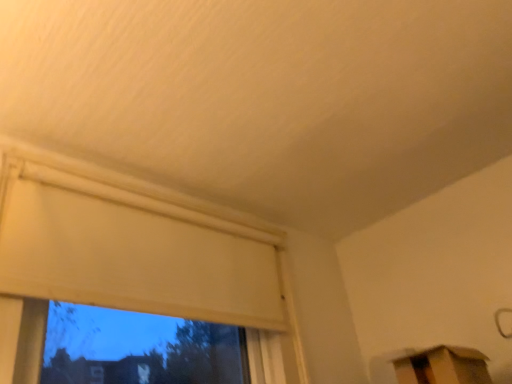
The image size is (512, 384). What do you see at coordinates (443, 366) in the screenshot? I see `cardboard box at lower right` at bounding box center [443, 366].

Identify the location of cardboard box at lower right. This screenshot has height=384, width=512. (443, 366).

What is the approximate height of cardboard box at lower right?

The height of cardboard box at lower right is 4.77 inches.

What do you see at coordinates (134, 267) in the screenshot?
I see `matte white window at upper left` at bounding box center [134, 267].

The height and width of the screenshot is (384, 512). I want to click on matte white window at upper left, so click(134, 267).

Identify the location of cardboard box at lower right. This screenshot has height=384, width=512. click(443, 366).

Is matte white window at upper left to the left of cardboard box at lower right from the viewer's perspective?

Yes, matte white window at upper left is to the left of cardboard box at lower right.

Which is in front, matte white window at upper left or cardboard box at lower right?

Positioned in front is matte white window at upper left.

Is point (32, 182) behind point (425, 377)?

Yes, point (32, 182) is behind point (425, 377).

From the image's perspective, which is above, matte white window at upper left or cardboard box at lower right?

matte white window at upper left, from the image's perspective.

From a real-world perspective, is matte white window at upper left under cardboard box at lower right?

Actually, matte white window at upper left is physically above cardboard box at lower right in the real world.

Can you confirm if matte white window at upper left is wider than cardboard box at lower right?

No, matte white window at upper left is not wider than cardboard box at lower right.

In terms of height, does matte white window at upper left look taller or shorter compared to cardboard box at lower right?

Clearly, matte white window at upper left is taller compared to cardboard box at lower right.

Who is bigger, matte white window at upper left or cardboard box at lower right?

matte white window at upper left.

Would you say matte white window at upper left contains cardboard box at lower right?

Actually, cardboard box at lower right is outside matte white window at upper left.

Would you consider matte white window at upper left to be distant from cardboard box at lower right?

No, matte white window at upper left is not far away from cardboard box at lower right.

Is matte white window at upper left facing towards cardboard box at lower right?

No, matte white window at upper left is not turned towards cardboard box at lower right.

Consider the image. How distant is matte white window at upper left from cardboard box at lower right?

They are 67.84 centimeters apart.

This screenshot has width=512, height=384. In order to click on furniture beneath the matte white window at upper left (from a real-world perspective) in this screenshot , I will do `click(443, 366)`.

Is cardboard box at lower right to the left of matte white window at upper left from the viewer's perspective?

No.

Relative to matte white window at upper left, is cardboard box at lower right in front or behind?

In the image, cardboard box at lower right appears behind matte white window at upper left.

Is point (475, 378) behind point (176, 299)?

No, it is in front of (176, 299).

From the image's perspective, is cardboard box at lower right on matte white window at upper left?

No, from the image's perspective, cardboard box at lower right is not over matte white window at upper left.

From a real-world perspective, between cardboard box at lower right and matte white window at upper left, who is vertically higher?

In real-world perspective, matte white window at upper left is above.

Looking at this image, considering the sizes of objects cardboard box at lower right and matte white window at upper left in the image provided, who is thinner, cardboard box at lower right or matte white window at upper left?

With smaller width is matte white window at upper left.

Looking at this image, from their relative heights in the image, would you say cardboard box at lower right is taller or shorter than matte white window at upper left?

cardboard box at lower right is shorter than matte white window at upper left.

Does cardboard box at lower right have a larger size compared to matte white window at upper left?

No.

Could matte white window at upper left be considered to be inside cardboard box at lower right?

That's incorrect, matte white window at upper left is not inside cardboard box at lower right.

Is cardboard box at lower right far from matte white window at upper left?

No, there isn't a large distance between cardboard box at lower right and matte white window at upper left.

Is cardboard box at lower right turned away from matte white window at upper left?

cardboard box at lower right is not turned away from matte white window at upper left.

How many degrees apart are the facing directions of cardboard box at lower right and matte white window at upper left?

92.8 degrees separate the facing orientations of cardboard box at lower right and matte white window at upper left.

Image resolution: width=512 pixels, height=384 pixels. I want to click on furniture that is under the matte white window at upper left (from a real-world perspective), so pos(443,366).

The height and width of the screenshot is (384, 512). Identify the location of furniture below the matte white window at upper left (from the image's perspective). (443, 366).

Identify the location of window above the cardboard box at lower right (from the image's perspective). This screenshot has width=512, height=384. (134, 267).